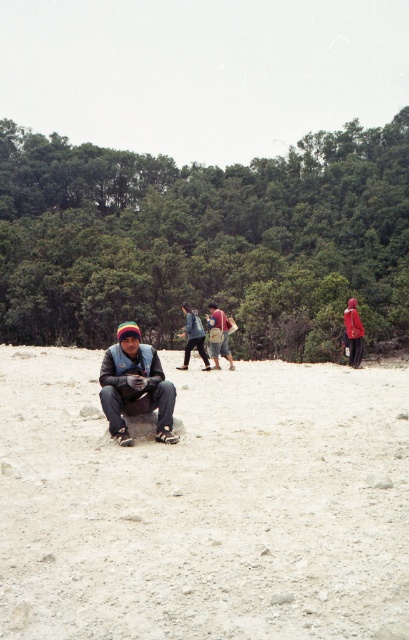
Question: Which of the following is the farthest from the observer?

Choices:
 (A) (148, 385)
 (B) (260, 588)

Answer: (A)

Question: Where is light brown sandy ground at center located in relation to denim jacket at center in the image?

Choices:
 (A) left
 (B) right

Answer: (B)

Question: Is light brown sandy ground at center thinner than denim jacket at center?

Choices:
 (A) no
 (B) yes

Answer: (A)

Question: Which object is closer to the camera taking this photo?

Choices:
 (A) light brown sandy ground at center
 (B) denim jacket at center

Answer: (A)

Question: Which of the following is the farthest from the observer?

Choices:
 (A) light brown sandy ground at center
 (B) denim jacket at center

Answer: (B)

Question: Is light brown sandy ground at center further to camera compared to denim jacket at center?

Choices:
 (A) yes
 (B) no

Answer: (B)